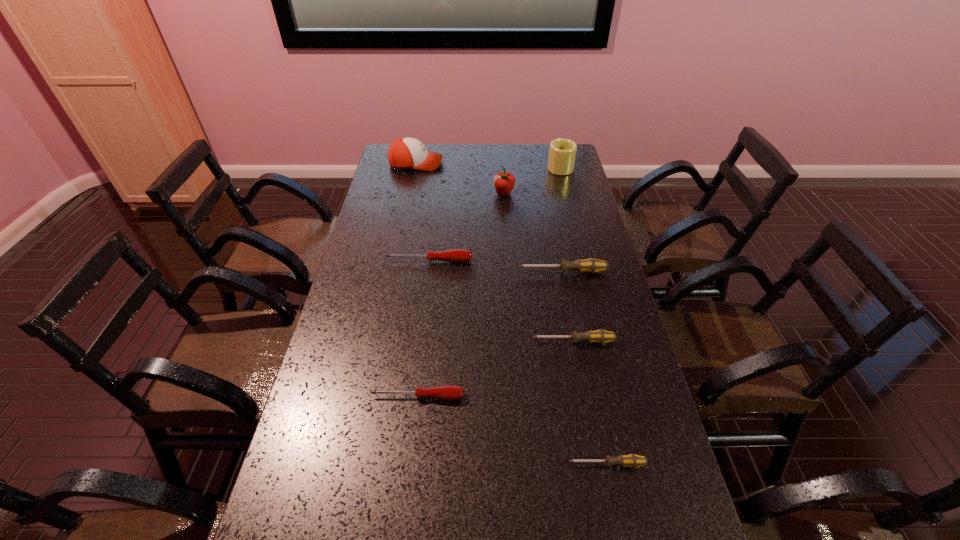
Find the location of `free spot between the apple and the beige mug`. free spot between the apple and the beige mug is located at coordinates (532, 180).

Where is `vacant space that's between the mug and the fourth farthest screwdriver`? vacant space that's between the mug and the fourth farthest screwdriver is located at coordinates (489, 281).

The width and height of the screenshot is (960, 540). Identify the location of blank region between the farthest screwdriver and the second nearest screwdriver. point(423,329).

Identify the location of empty space that is in between the baseball cap and the third nearest screwdriver. This screenshot has width=960, height=540. (494, 253).

The image size is (960, 540). I want to click on free space that is in between the mug and the second nearest screwdriver, so click(x=489, y=281).

Find the location of a particular element. The height and width of the screenshot is (540, 960). vacant area that lies between the bigger red screwdriver and the second nearest object is located at coordinates (423, 329).

Locate an element on the screen. free space between the baseball cap and the fourth nearest screwdriver is located at coordinates (490, 218).

Identify which object is located as the third nearest to the biggest gray screwdriver. Please provide its 2D coordinates. Your answer should be formatted as a tuple, i.e. [(x, y)], where the tuple contains the x and y coordinates of a point satisfying the conditions above.

[(504, 182)]

I want to click on the closest object to the third farthest object, so click(562, 152).

Select which screwdriver is the third closest to the shortest object. Please provide its 2D coordinates. Your answer should be formatted as a tuple, i.e. [(x, y)], where the tuple contains the x and y coordinates of a point satisfying the conditions above.

[(591, 265)]